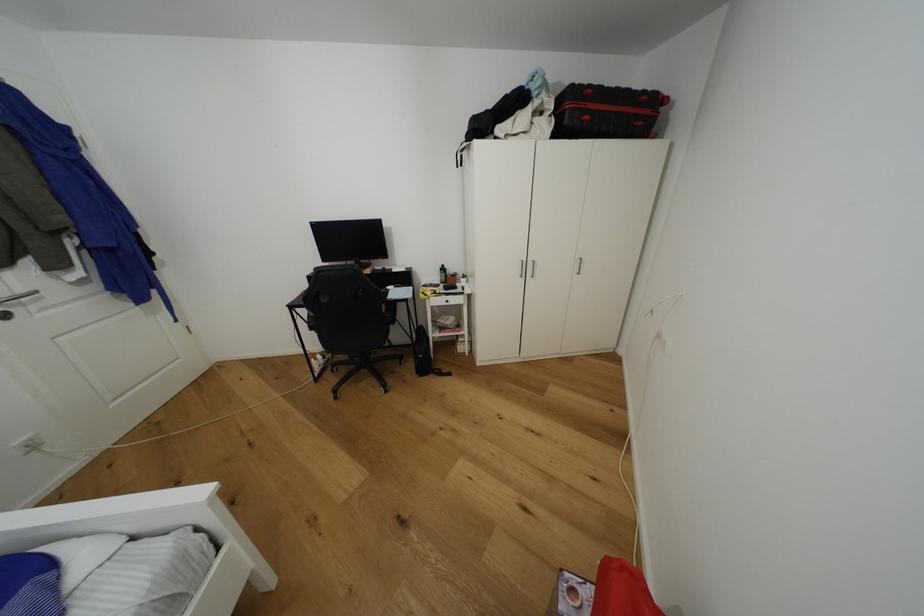
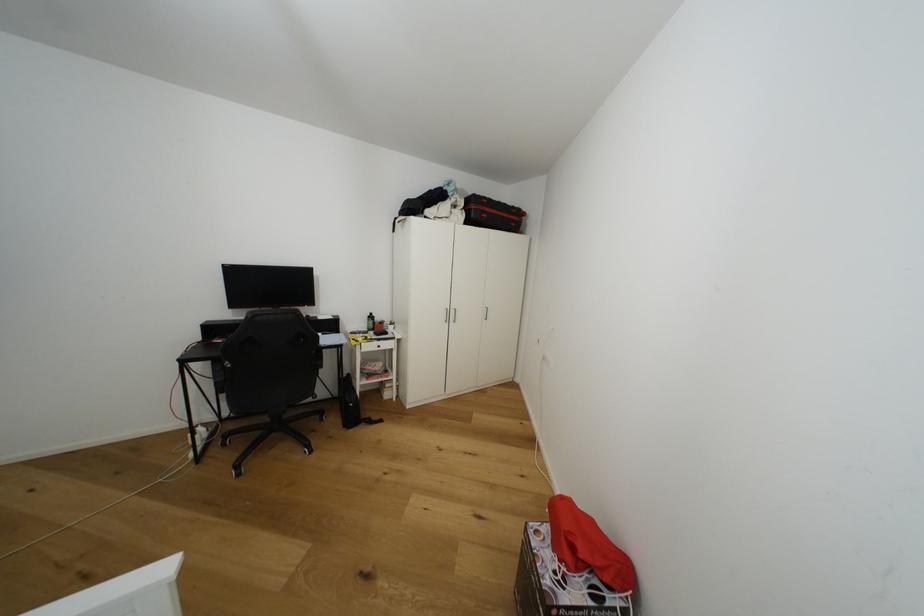
Question: How did the camera likely rotate?

Choices:
 (A) Left
 (B) Right
 (C) Up
 (D) Down

Answer: (B)